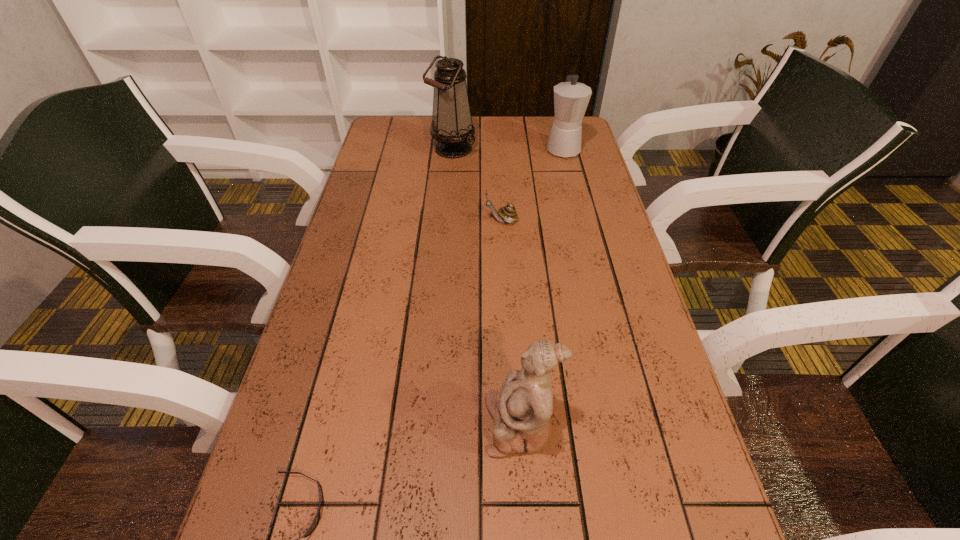
The height and width of the screenshot is (540, 960). Identify the location of free location that satisfies the following two spatial constraints: 1. on the back side of the oil lamp; 2. on the right side of the coffeepot. (452, 148).